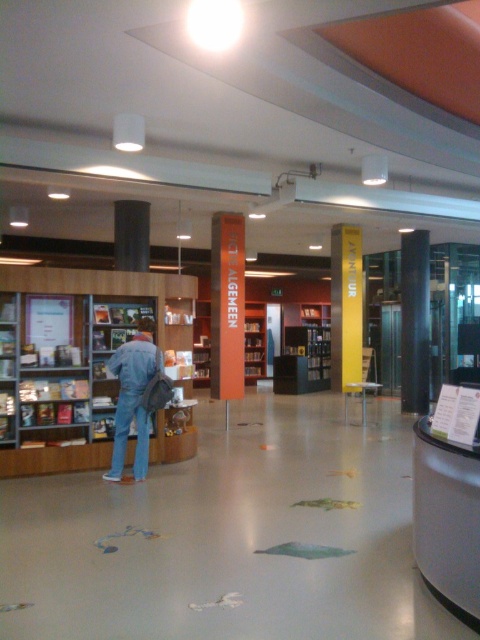
Between metallic gray desk at lower right and orange matte bookshelf at center, which one appears on the right side from the viewer's perspective?

Positioned to the right is metallic gray desk at lower right.

Between point (468, 557) and point (252, 321), which one is positioned behind?

Point (252, 321)

Is point (433, 435) positioned behind point (245, 362)?

No, it is in front of (245, 362).

The image size is (480, 640). Identify the location of metallic gray desk at lower right. (446, 520).

Is wooden bookshelf at left smaller than denim jacket at center?

No.

Does wooden bookshelf at left appear over denim jacket at center?

Yes, wooden bookshelf at left is above denim jacket at center.

Describe the element at coordinates (83, 358) in the screenshot. The width and height of the screenshot is (480, 640). I see `wooden bookshelf at left` at that location.

I want to click on wooden bookshelf at left, so click(x=83, y=358).

Who is positioned more to the left, denim jacket at center or orange matte bookshelf at center?

From the viewer's perspective, orange matte bookshelf at center appears more on the left side.

Does denim jacket at center appear on the left side of orange matte bookshelf at center?

Incorrect, denim jacket at center is not on the left side of orange matte bookshelf at center.

Identify the location of denim jacket at center. This screenshot has width=480, height=640. click(x=132, y=397).